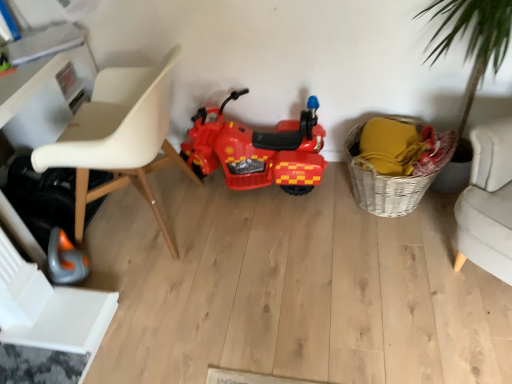
At what (x,y) coordinates should I click in order to perform the action: click on vacant space that's between white plastic chair at left and woven basket at lower right. Please return your answer as a coordinate pair (x, y). Looking at the image, I should click on (294, 226).